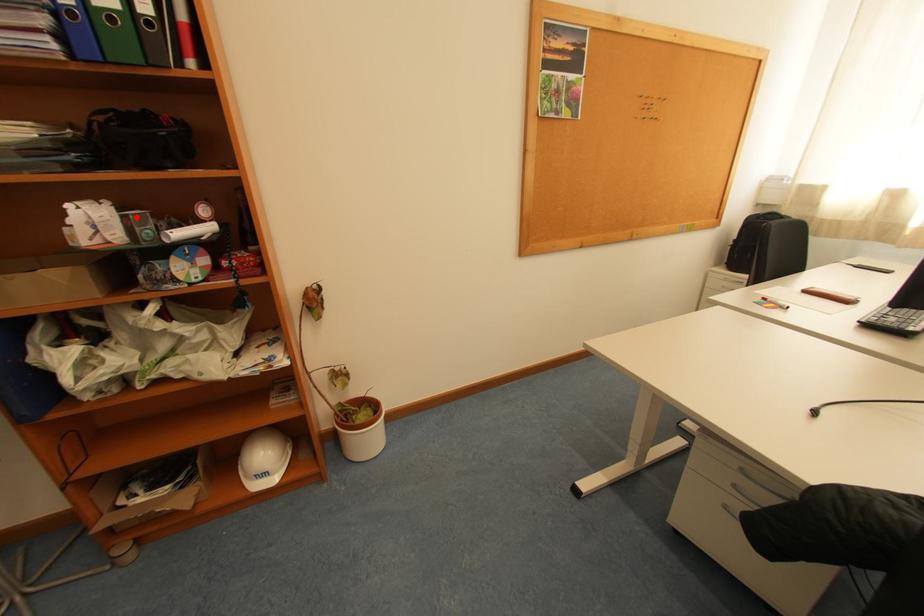
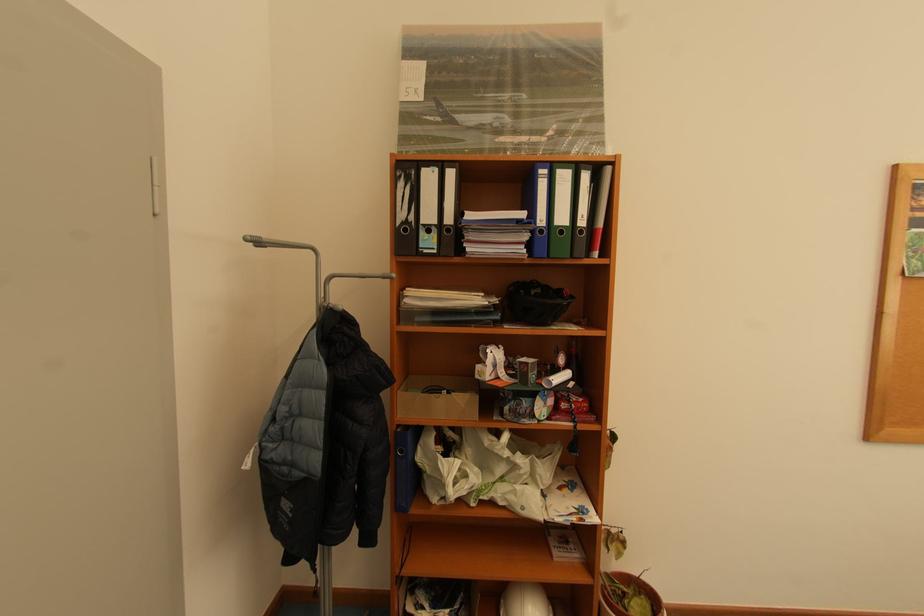
Find the pixel in the second image that matches the highlighted location in the first image.

(536, 365)